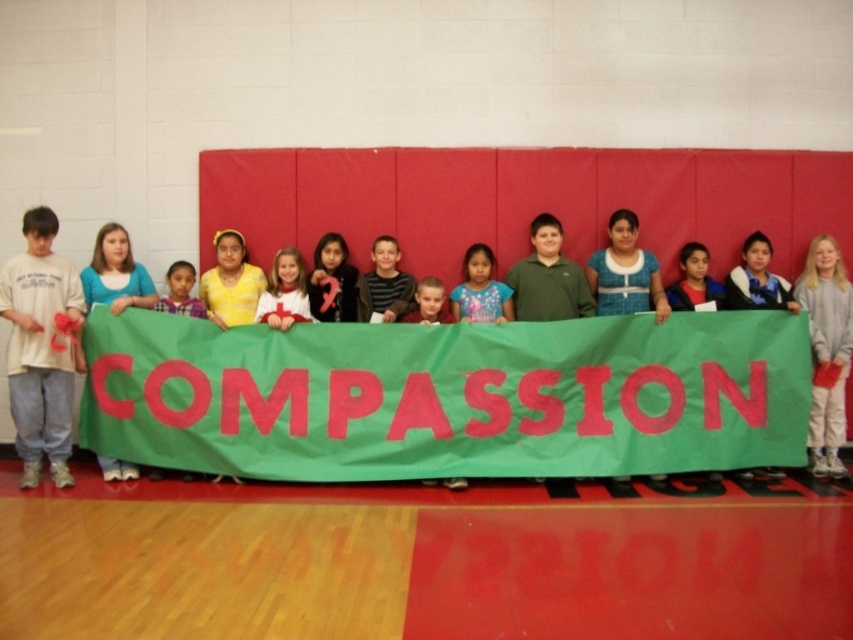
Does matte yellow shirt at center have a smaller size compared to smooth blue shirt at center?

Indeed, matte yellow shirt at center has a smaller size compared to smooth blue shirt at center.

Can you confirm if matte yellow shirt at center is wider than smooth blue shirt at center?

No.

Measure the distance between matte yellow shirt at center and camera.

matte yellow shirt at center and camera are 6.47 meters apart from each other.

Where is `matte yellow shirt at center`? The width and height of the screenshot is (853, 640). matte yellow shirt at center is located at coordinates (180, 291).

Between white cotton shirt at left and printed cotton shirt at center, which one is positioned higher?

printed cotton shirt at center is above.

Does white cotton shirt at left have a smaller size compared to printed cotton shirt at center?

Actually, white cotton shirt at left might be larger than printed cotton shirt at center.

Who is more forward, (x=16, y=310) or (x=479, y=308)?

Point (x=16, y=310) is in front.

Where is `white cotton shirt at left`? This screenshot has width=853, height=640. white cotton shirt at left is located at coordinates 41,348.

Which is behind, point (67, 392) or point (428, 282)?

The point (428, 282) is behind.

Which is more to the left, white cotton shirt at left or smooth blue shirt at center?

white cotton shirt at left

Does point (44, 285) lie in front of point (439, 317)?

Yes, point (44, 285) is closer to viewer.

Identify the location of white cotton shirt at left. Image resolution: width=853 pixels, height=640 pixels. (41, 348).